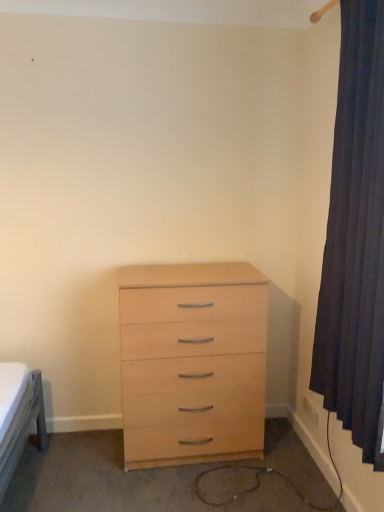
Describe the element at coordinates (355, 238) in the screenshot. I see `dark blue fabric curtain at right` at that location.

The image size is (384, 512). In order to click on dark blue fabric curtain at right in this screenshot , I will do `click(355, 238)`.

Measure the distance between point (x=124, y=305) and camera.

The depth of point (x=124, y=305) is 2.09 meters.

Identify the location of light wood chest of drawers at center. The image size is (384, 512). (192, 362).

What is the approximate height of light wood chest of drawers at center?

The height of light wood chest of drawers at center is 3.38 feet.

Describe the element at coordinates (192, 362) in the screenshot. I see `light wood chest of drawers at center` at that location.

At what (x,y) coordinates should I click in order to perform the action: click on dark blue fabric curtain at right. Please return your answer as a coordinate pair (x, y). This screenshot has height=512, width=384. Looking at the image, I should click on (355, 238).

Between dark blue fabric curtain at right and light wood chest of drawers at center, which one appears on the right side from the viewer's perspective?

Positioned to the right is dark blue fabric curtain at right.

Does dark blue fabric curtain at right lie behind light wood chest of drawers at center?

No, dark blue fabric curtain at right is in front of light wood chest of drawers at center.

Does point (343, 220) appear closer or farther from the camera than point (167, 364)?

Clearly, point (343, 220) is closer to the camera than point (167, 364).

From the picture: From the image's perspective, would you say dark blue fabric curtain at right is positioned over light wood chest of drawers at center?

Yes, from the image's perspective, dark blue fabric curtain at right is on top of light wood chest of drawers at center.

From a real-world perspective, which is physically below, dark blue fabric curtain at right or light wood chest of drawers at center?

light wood chest of drawers at center is physically lower.

Is dark blue fabric curtain at right thinner than light wood chest of drawers at center?

Indeed, dark blue fabric curtain at right has a lesser width compared to light wood chest of drawers at center.

Does dark blue fabric curtain at right have a greater height compared to light wood chest of drawers at center?

Yes, dark blue fabric curtain at right is taller than light wood chest of drawers at center.

Considering the relative sizes of dark blue fabric curtain at right and light wood chest of drawers at center in the image provided, is dark blue fabric curtain at right smaller than light wood chest of drawers at center?

Indeed, dark blue fabric curtain at right has a smaller size compared to light wood chest of drawers at center.

Would you say dark blue fabric curtain at right is outside light wood chest of drawers at center?

dark blue fabric curtain at right is positioned outside light wood chest of drawers at center.

Is dark blue fabric curtain at right far from light wood chest of drawers at center?

No.

Could you tell me if dark blue fabric curtain at right is turned towards light wood chest of drawers at center?

No, dark blue fabric curtain at right is not aimed at light wood chest of drawers at center.

The image size is (384, 512). I want to click on the chest of drawers behind the dark blue fabric curtain at right, so click(192, 362).

Would you say light wood chest of drawers at center is to the left or to the right of dark blue fabric curtain at right in the picture?

Clearly, light wood chest of drawers at center is on the left of dark blue fabric curtain at right in the image.

Is light wood chest of drawers at center further to camera compared to dark blue fabric curtain at right?

Yes, the depth of light wood chest of drawers at center is greater than that of dark blue fabric curtain at right.

Does point (236, 306) lie in front of point (378, 5)?

No, (236, 306) is behind (378, 5).

From the image's perspective, is light wood chest of drawers at center on dark blue fabric curtain at right?

No.

From a real-world perspective, which is physically above, light wood chest of drawers at center or dark blue fabric curtain at right?

dark blue fabric curtain at right is physically above.

Which of these two, light wood chest of drawers at center or dark blue fabric curtain at right, is wider?

light wood chest of drawers at center is wider.

Does light wood chest of drawers at center have a lesser height compared to dark blue fabric curtain at right?

Yes.

Between light wood chest of drawers at center and dark blue fabric curtain at right, which one has larger size?

light wood chest of drawers at center is bigger.

Is dark blue fabric curtain at right inside light wood chest of drawers at center?

That's incorrect, dark blue fabric curtain at right is not inside light wood chest of drawers at center.

Is light wood chest of drawers at center next to dark blue fabric curtain at right?

No, light wood chest of drawers at center is not next to dark blue fabric curtain at right.

Looking at this image, is light wood chest of drawers at center positioned with its back to dark blue fabric curtain at right?

No, light wood chest of drawers at center is not facing the opposite direction of dark blue fabric curtain at right.

How many degrees apart are the facing directions of light wood chest of drawers at center and dark blue fabric curtain at right?

There is a 89.5-degree angle between the facing directions of light wood chest of drawers at center and dark blue fabric curtain at right.

The image size is (384, 512). I want to click on the chest of drawers that appears below the dark blue fabric curtain at right (from the image's perspective), so click(x=192, y=362).

At what (x,y) coordinates should I click in order to perform the action: click on the chest of drawers that appears behind the dark blue fabric curtain at right. Please return your answer as a coordinate pair (x, y). This screenshot has height=512, width=384. Looking at the image, I should click on (192, 362).

In the image, there is a light wood chest of drawers at center. Identify the location of curtain above it (from the image's perspective). The height and width of the screenshot is (512, 384). (355, 238).